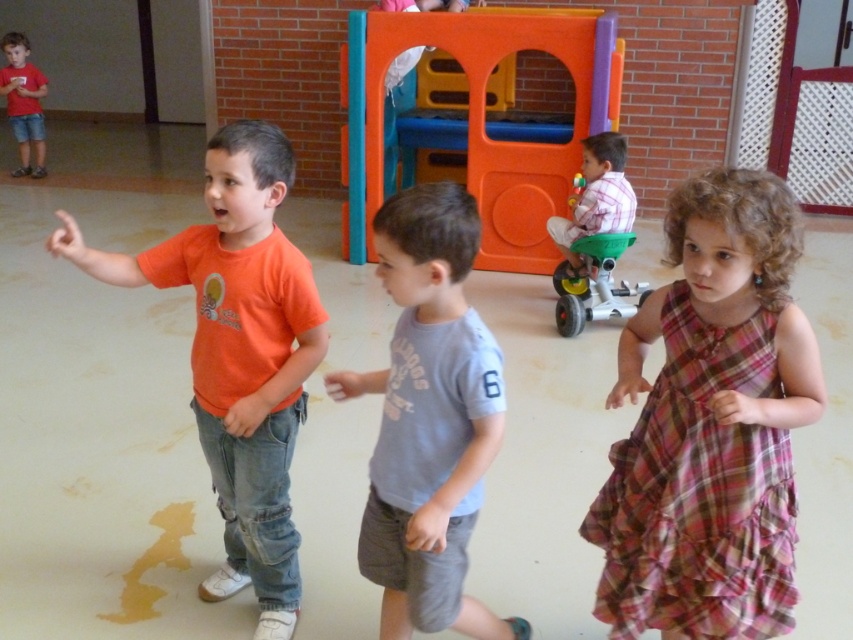
Is orange cotton t-shirt at left to the right of gray cotton t-shirt at center from the viewer's perspective?

Incorrect, orange cotton t-shirt at left is not on the right side of gray cotton t-shirt at center.

Who is lower down, orange cotton t-shirt at left or gray cotton t-shirt at center?

gray cotton t-shirt at center is below.

Who is more forward, (x=225, y=563) or (x=415, y=490)?

Positioned in front is point (x=415, y=490).

Identify the location of orange cotton t-shirt at left. (239, 353).

Who is higher up, plaid fabric dress at center or green plastic tricycle at right?

green plastic tricycle at right is above.

Which is in front, point (641, 330) or point (625, 284)?

Positioned in front is point (641, 330).

Locate an element on the screen. Image resolution: width=853 pixels, height=640 pixels. plaid fabric dress at center is located at coordinates (711, 424).

Can you confirm if plaid fabric shirt at center is positioned to the right of matte red shirt at upper left?

Indeed, plaid fabric shirt at center is positioned on the right side of matte red shirt at upper left.

Which is in front, point (595, 176) or point (10, 68)?

Positioned in front is point (595, 176).

Locate an element on the screen. This screenshot has width=853, height=640. plaid fabric shirt at center is located at coordinates (596, 196).